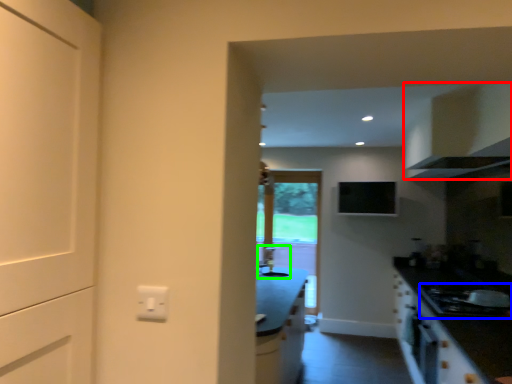
Question: Estimate the real-world distances between objects in this image. Which object is closer to cabinetry (highlighted by a red box), gas stove (highlighted by a blue box) or sink (highlighted by a green box)?

Choices:
 (A) gas stove
 (B) sink

Answer: (A)